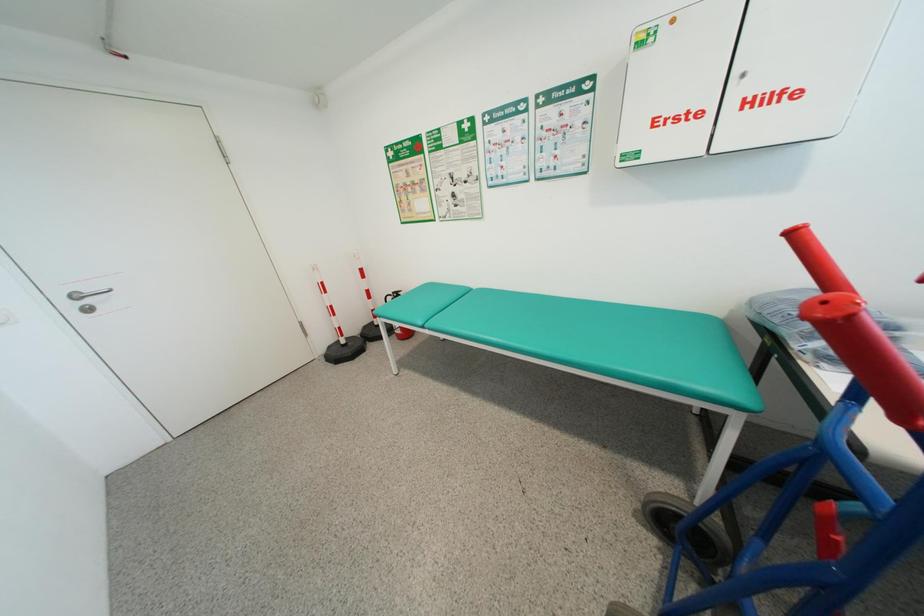
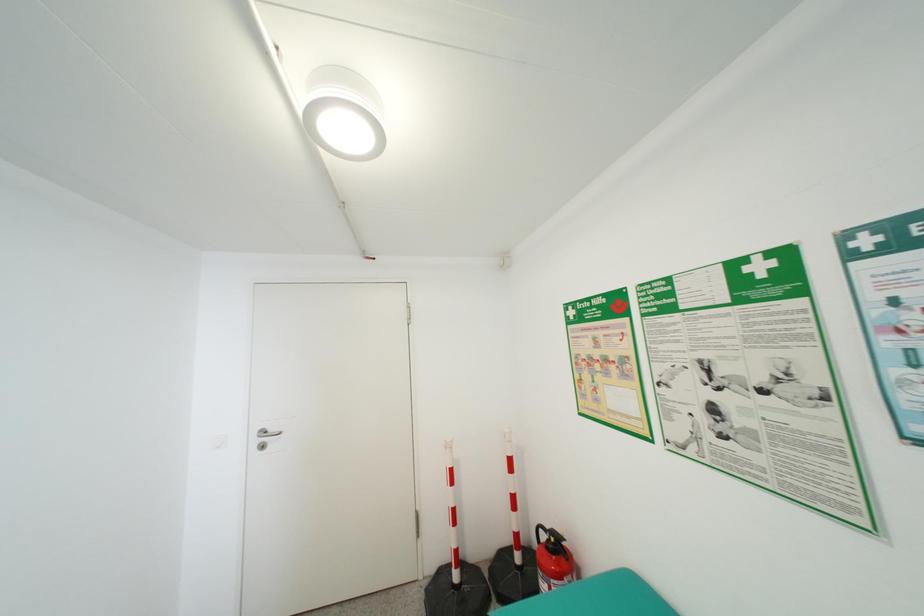
How did the camera likely rotate?

The rotation direction of the camera is left-up.